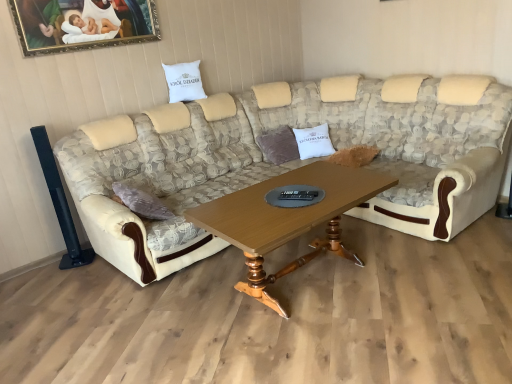
Question: Is woodenwoodencoffee table at center to the right of gold-framed painting at upper left from the viewer's perspective?

Choices:
 (A) no
 (B) yes

Answer: (B)

Question: Is woodenwoodencoffee table at center taller than gold-framed painting at upper left?

Choices:
 (A) no
 (B) yes

Answer: (B)

Question: Can you confirm if woodenwoodencoffee table at center is thinner than gold-framed painting at upper left?

Choices:
 (A) no
 (B) yes

Answer: (A)

Question: Is woodenwoodencoffee table at center at the left side of gold-framed painting at upper left?

Choices:
 (A) no
 (B) yes

Answer: (A)

Question: Is woodenwoodencoffee table at center positioned in front of gold-framed painting at upper left?

Choices:
 (A) no
 (B) yes

Answer: (B)

Question: Looking at their shapes, would you say beige fabric couch at center is wider or thinner than gold-framed painting at upper left?

Choices:
 (A) wide
 (B) thin

Answer: (A)

Question: Is beige fabric couch at center to the left or to the right of gold-framed painting at upper left in the image?

Choices:
 (A) left
 (B) right

Answer: (B)

Question: Is beige fabric couch at center in front of or behind gold-framed painting at upper left in the image?

Choices:
 (A) behind
 (B) front

Answer: (B)

Question: Is beige fabric couch at center taller or shorter than gold-framed painting at upper left?

Choices:
 (A) tall
 (B) short

Answer: (A)

Question: From a real-world perspective, relative to woodenwoodencoffee table at center, is gold-framed painting at upper left vertically above or below?

Choices:
 (A) below
 (B) above

Answer: (B)

Question: From the image's perspective, is gold-framed painting at upper left positioned above or below woodenwoodencoffee table at center?

Choices:
 (A) below
 (B) above

Answer: (B)

Question: Do you think gold-framed painting at upper left is within woodenwoodencoffee table at center, or outside of it?

Choices:
 (A) inside
 (B) outside

Answer: (B)

Question: Is gold-framed painting at upper left to the left or to the right of woodenwoodencoffee table at center in the image?

Choices:
 (A) right
 (B) left

Answer: (B)

Question: From the image's perspective, is white cotton pillow at center, placed as the 1th pillow when sorted from right to left, above or below white fabric pillow at upper center, which ranks as the first pillow in left-to-right order?

Choices:
 (A) below
 (B) above

Answer: (A)

Question: In terms of height, does white cotton pillow at center, arranged as the second pillow when viewed from the left, look taller or shorter compared to white fabric pillow at upper center, arranged as the second pillow when viewed from the right?

Choices:
 (A) tall
 (B) short

Answer: (A)